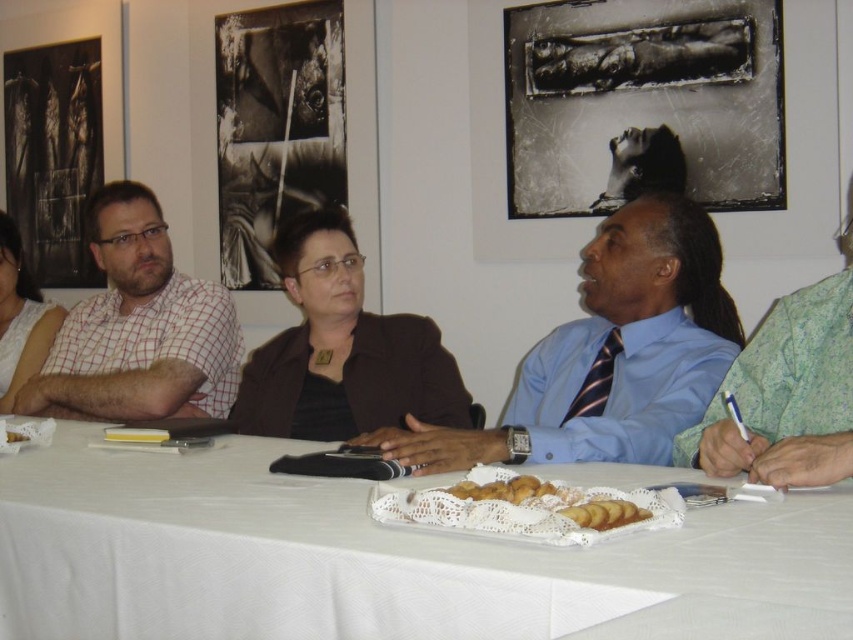
Is point (148, 461) positioned behind point (839, 416)?

Yes, it is.

Is point (195, 483) positioned behind point (691, 448)?

No, (195, 483) is in front of (691, 448).

At what (x,y) coordinates should I click in order to perform the action: click on white cloth table at center. Please return your answer as a coordinate pair (x, y). The width and height of the screenshot is (853, 640). Looking at the image, I should click on click(376, 560).

Can you confirm if green floral shirt at right is shorter than golden brown pastry at center?

Incorrect, green floral shirt at right's height does not fall short of golden brown pastry at center's.

Does green floral shirt at right have a greater width compared to golden brown pastry at center?

Indeed, green floral shirt at right has a greater width compared to golden brown pastry at center.

Is point (785, 326) less distant than point (608, 506)?

No, (785, 326) is further to viewer.

Locate an element on the screen. green floral shirt at right is located at coordinates (787, 392).

Does blue shirt and tie at center have a greater width compared to checkered fabric shirt at left?

Yes.

Find the location of a particular element. blue shirt and tie at center is located at coordinates [x=611, y=353].

Identify the location of blue shirt and tie at center. The height and width of the screenshot is (640, 853). (611, 353).